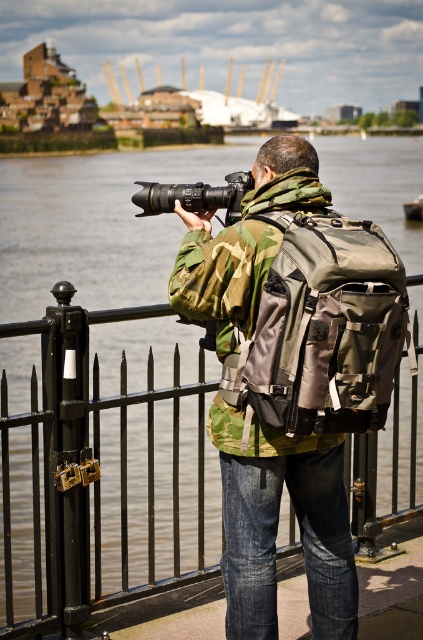
Question: Which point appears closest to the camera in this image?

Choices:
 (A) (378, 396)
 (B) (348, 419)
 (C) (356, 442)

Answer: (B)

Question: From the image, what is the correct spatial relationship of camo fabric jacket at center in relation to matte black camera at center?

Choices:
 (A) left
 (B) right

Answer: (B)

Question: Which is nearer to the camouflage fabric backpack at center?

Choices:
 (A) camo fabric jacket at center
 (B) matte black camera at center

Answer: (A)

Question: Can you confirm if camouflage fabric backpack at center is thinner than matte black camera at center?

Choices:
 (A) yes
 (B) no

Answer: (A)

Question: Among these objects, which one is farthest from the camera?

Choices:
 (A) black metal fence at lower center
 (B) camouflage fabric backpack at center
 (C) matte black camera at center
 (D) camo fabric jacket at center

Answer: (C)

Question: Does camouflage fabric backpack at center appear under matte black camera at center?

Choices:
 (A) no
 (B) yes

Answer: (B)